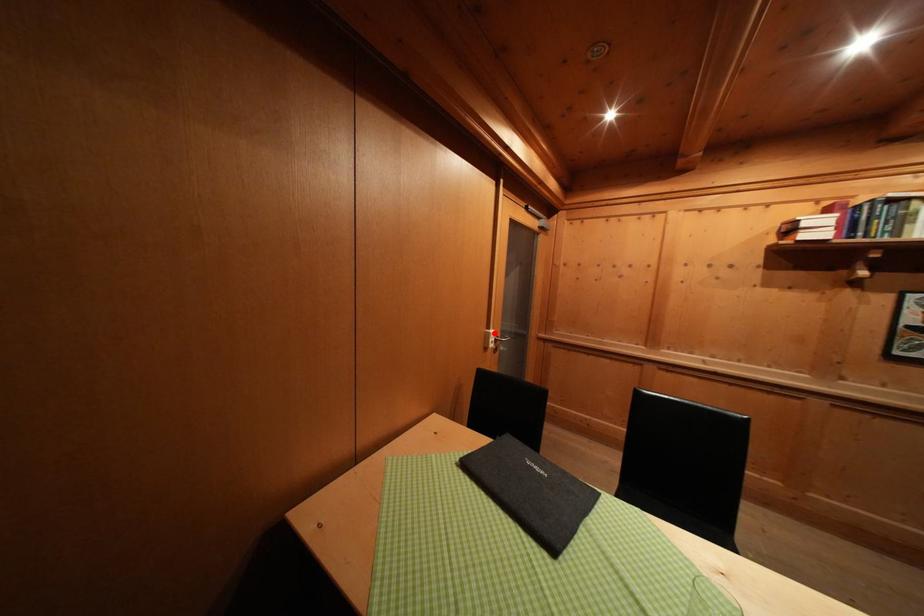
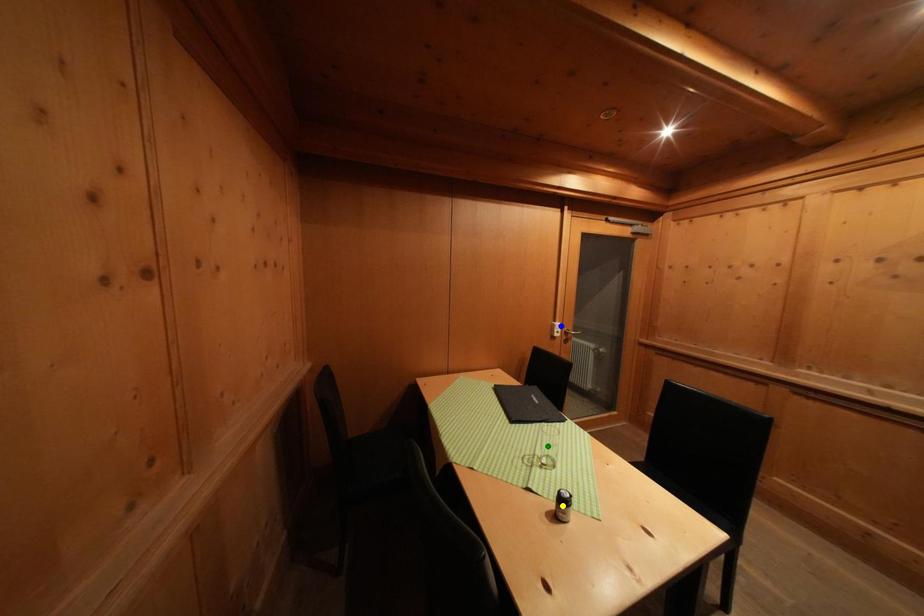
Question: I am providing you with two images of the same scene from different viewpoints. A red point is marked on the first image. You are given multiple points on the second image. Which spot in image 2 lines up with the point in image 1?

Choices:
 (A) green point
 (B) blue point
 (C) yellow point

Answer: (B)